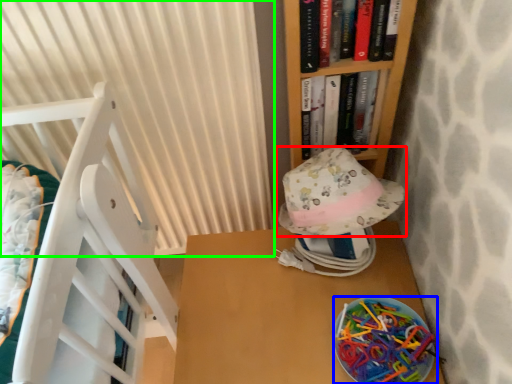
Question: Estimate the real-world distances between objects in this image. Which object is closer to hat (highlighted by a red box), stuff (highlighted by a blue box) or curtain (highlighted by a green box)?

Choices:
 (A) stuff
 (B) curtain

Answer: (A)